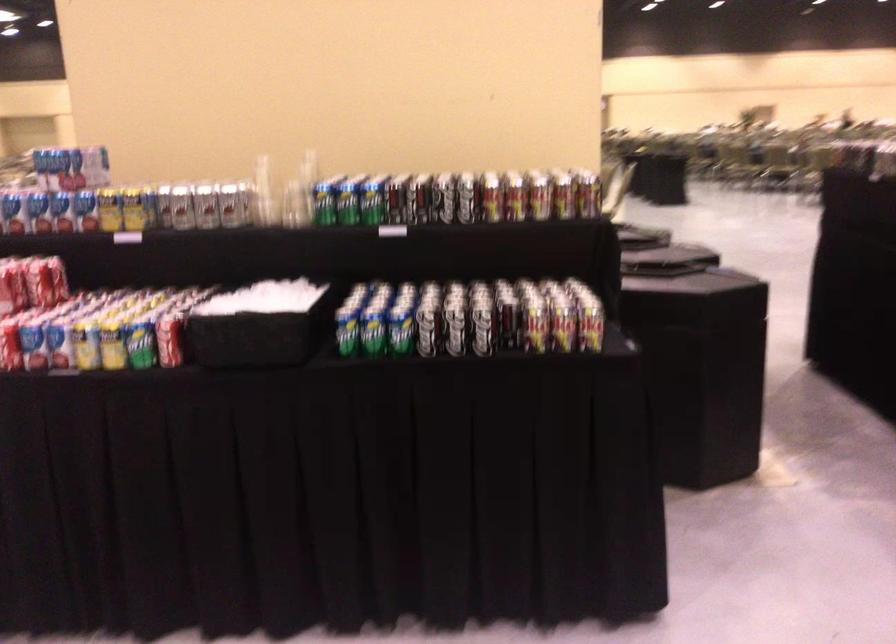
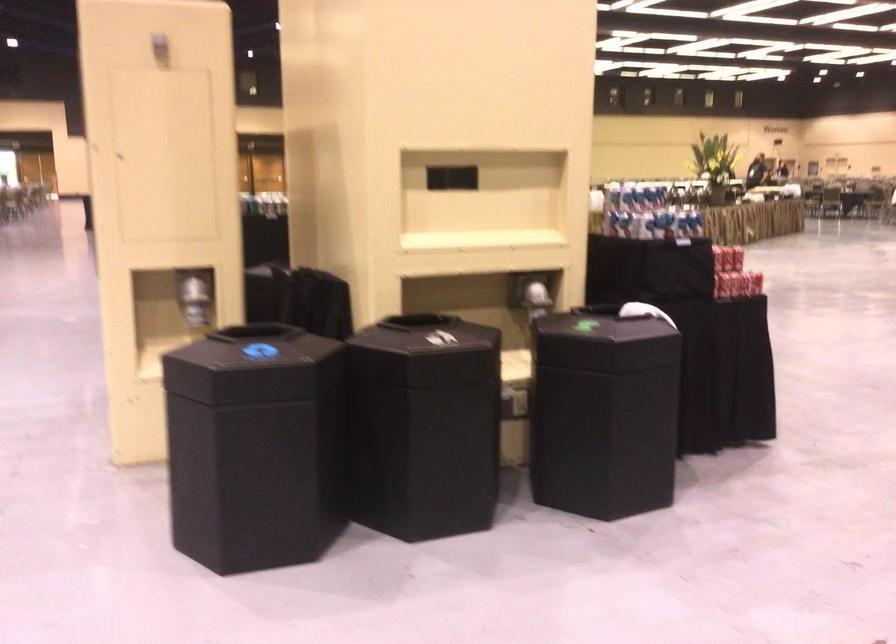
Question: I am providing you with two images of the same scene from different viewpoints. After the viewpoint changes to image2, which objects are now occluded?

Choices:
 (A) silver soda can
 (B) black bin lid
 (C) shiny dispenser lever
 (D) black book

Answer: (A)